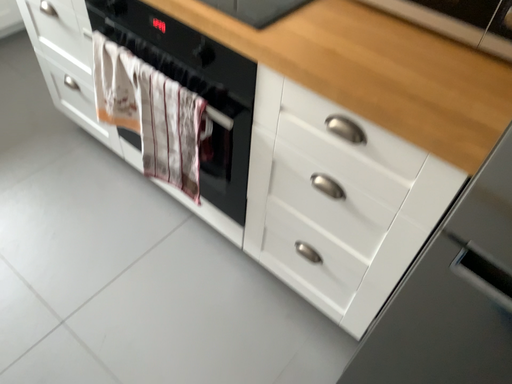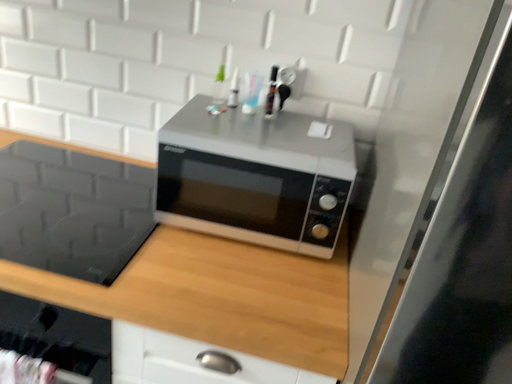
Question: Which way did the camera rotate in the video?

Choices:
 (A) rotated left
 (B) rotated right

Answer: (B)